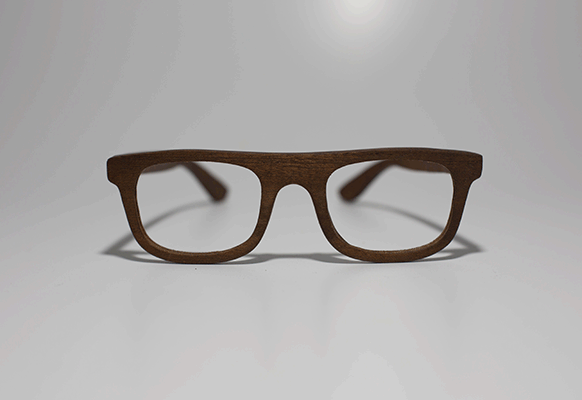
Where is `hinge`? The image size is (582, 400). hinge is located at coordinates (333, 150).